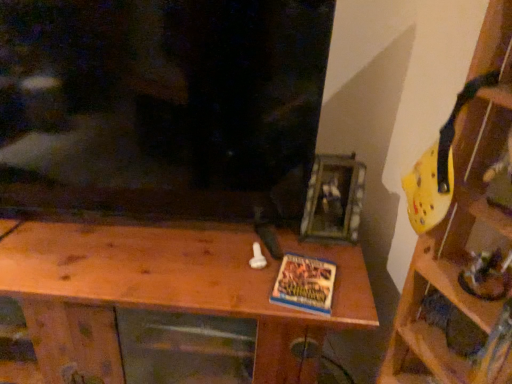
Question: Is blue matte book at center to the left or to the right of yellow plastic helmet at upper right, the first shelf from the right, in the image?

Choices:
 (A) right
 (B) left

Answer: (B)

Question: Is blue matte book at center bigger or smaller than yellow plastic helmet at upper right, arranged as the second shelf when viewed from the left?

Choices:
 (A) small
 (B) big

Answer: (A)

Question: Which object is positioned closest to the yellow plastic helmet at upper right, the first shelf from the right?

Choices:
 (A) blue matte book at center
 (B) wooden at center, positioned as the 1th shelf in left-to-right order

Answer: (A)

Question: Estimate the real-world distances between objects in this image. Which object is closer to the wooden at center, positioned as the 1th shelf in left-to-right order?

Choices:
 (A) blue matte book at center
 (B) yellow plastic helmet at upper right, arranged as the second shelf when viewed from the left

Answer: (A)